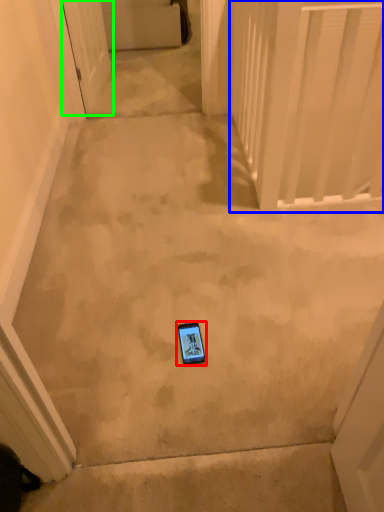
Question: Considering the real-world distances, which object is farthest from mobile phone (highlighted by a red box)? balustrade (highlighted by a blue box) or door (highlighted by a green box)?

Choices:
 (A) balustrade
 (B) door

Answer: (B)